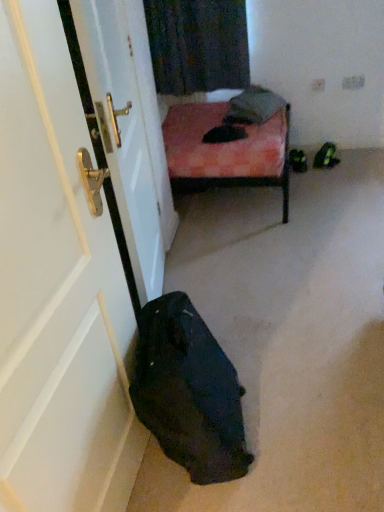
Question: Is matte white door at left to the left or to the right of velvet pink cushion at upper center in the image?

Choices:
 (A) left
 (B) right

Answer: (A)

Question: Is matte white door at left in front of or behind velvet pink cushion at upper center in the image?

Choices:
 (A) front
 (B) behind

Answer: (A)

Question: In terms of size, does matte white door at left appear bigger or smaller than velvet pink cushion at upper center?

Choices:
 (A) big
 (B) small

Answer: (A)

Question: Considering the positions of velvet pink cushion at upper center and matte white door at left in the image, is velvet pink cushion at upper center bigger or smaller than matte white door at left?

Choices:
 (A) small
 (B) big

Answer: (A)

Question: In the image, is velvet pink cushion at upper center positioned in front of or behind matte white door at left?

Choices:
 (A) behind
 (B) front

Answer: (A)

Question: Looking at their shapes, would you say velvet pink cushion at upper center is wider or thinner than matte white door at left?

Choices:
 (A) thin
 (B) wide

Answer: (B)

Question: Is velvet pink cushion at upper center spatially inside matte white door at left, or outside of it?

Choices:
 (A) outside
 (B) inside

Answer: (A)